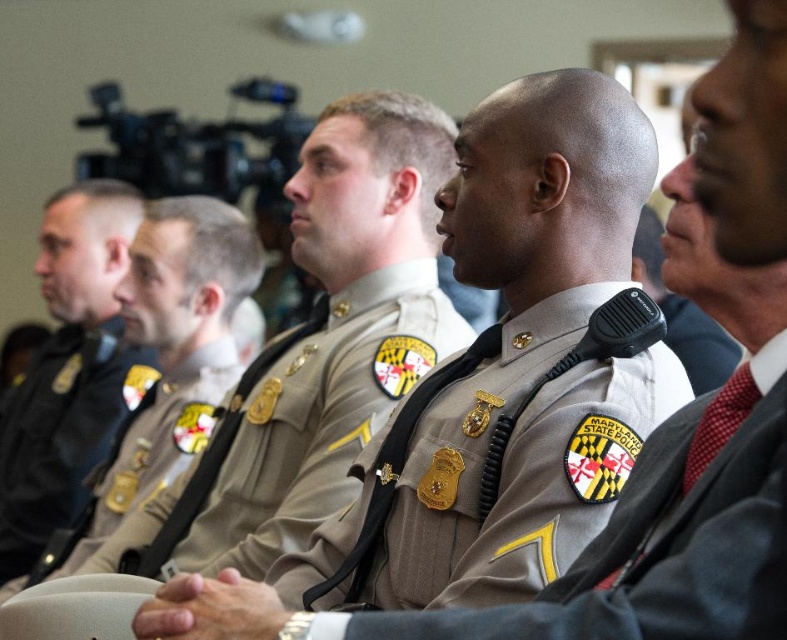
Question: Which of these objects is positioned farthest from the red silk tie at center?

Choices:
 (A) matte black uniform at left
 (B) tan fabric uniform at center

Answer: (A)

Question: Observing the image, what is the correct spatial positioning of brown uniform at center in reference to red silk tie at center?

Choices:
 (A) below
 (B) above

Answer: (A)

Question: Can you confirm if tan/striped fabric uniform at center is wider than red silk tie at center?

Choices:
 (A) yes
 (B) no

Answer: (A)

Question: Which point is closer to the camera?

Choices:
 (A) tan/striped fabric uniform at center
 (B) brown uniform at center
 (C) light brown fabric uniform at center

Answer: (B)

Question: Is tan fabric uniform at center to the right of tan/striped fabric uniform at center from the viewer's perspective?

Choices:
 (A) no
 (B) yes

Answer: (B)

Question: Which object is positioned farthest from the red silk tie at center?

Choices:
 (A) matte black uniform at left
 (B) brown uniform at center
 (C) tan fabric uniform at center
 (D) tan/striped fabric uniform at center

Answer: (A)